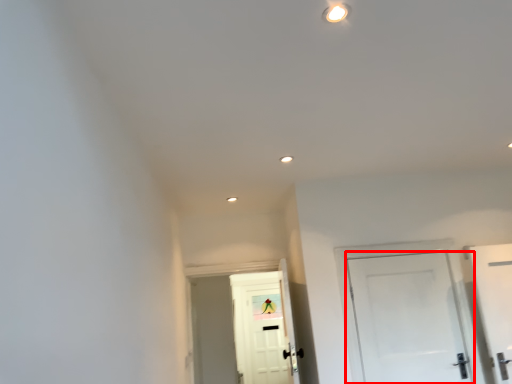
Question: From the image's perspective, where is door (annotated by the red box) located relative to door?

Choices:
 (A) below
 (B) above

Answer: (B)